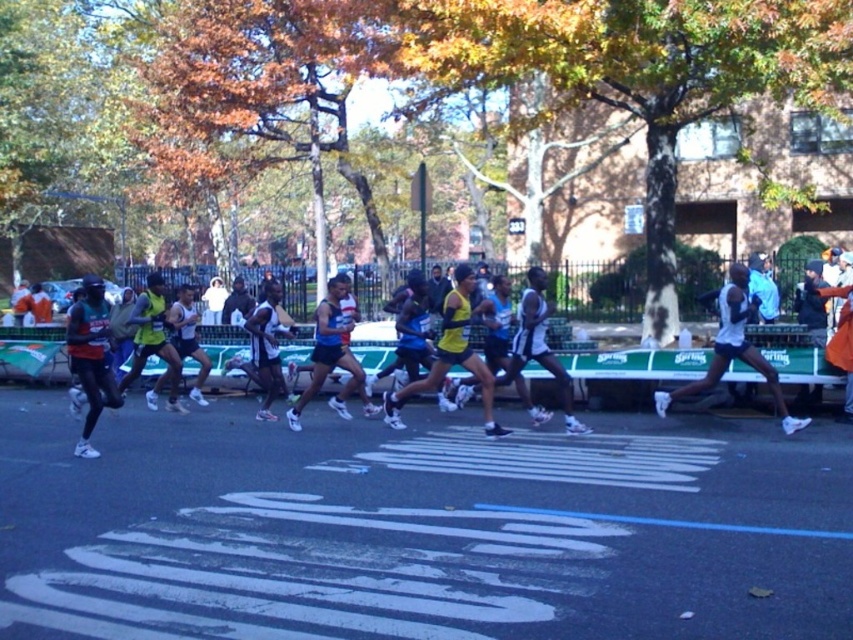
Between white matte running shoe at right and matte yellow tank top at center, which one appears on the left side from the viewer's perspective?

From the viewer's perspective, matte yellow tank top at center appears more on the left side.

Can you confirm if white matte running shoe at right is thinner than matte yellow tank top at center?

Incorrect, white matte running shoe at right's width is not less than matte yellow tank top at center's.

Locate an element on the screen. The image size is (853, 640). white matte running shoe at right is located at coordinates (733, 348).

Who is more distant from viewer, (343, 296) or (253, 342)?

The point (253, 342) is behind.

Which of these two, blue fabric shorts at center or black athletic wear at center, stands taller?

Standing taller between the two is black athletic wear at center.

Is point (344, 324) positioned behind point (276, 362)?

No, (344, 324) is in front of (276, 362).

This screenshot has height=640, width=853. In order to click on blue fabric shorts at center in this screenshot , I will do `click(329, 353)`.

How much distance is there between white matte running shoe at right and black athletic wear at center?

They are 19.15 feet apart.

Is white matte running shoe at right closer to camera compared to black athletic wear at center?

Yes, it is in front of black athletic wear at center.

Find the location of a particular element. white matte running shoe at right is located at coordinates (733, 348).